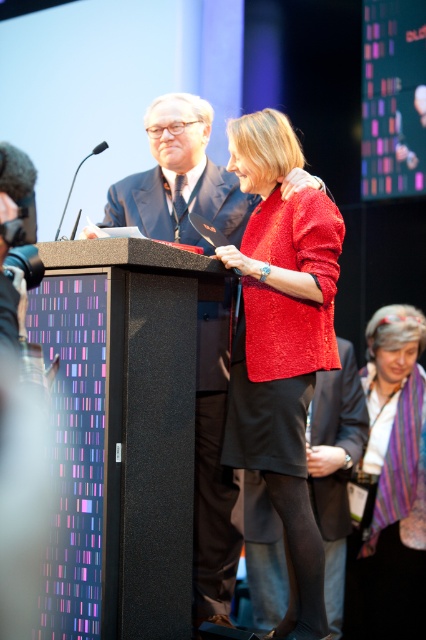
You are organizing a photo shoot and need to place a small decorative item between the matte black suit at center and the multicolored woven scarf at lower right. Based on their sizes, where should you position the item to ensure it fits comfortably between them?

The matte black suit at center is wider than the multicolored woven scarf at lower right, so place the item closer to the scarf side to accommodate the size difference.

You are an event organizer who needs to ensure that the matte black suit at center and the multicolored woven scarf at lower right can fit on a display stand. The stand has a maximum capacity of 10 kilograms. Knowing that the size difference between them is significant, can you determine which one is heavier?

The matte black suit at center is larger in size than the multicolored woven scarf at lower right, so it is likely heavier. However, without specific weight information, we cannot be certain. The size difference suggests the matte black suit at center might exceed the stand capacity, so check its weight first.